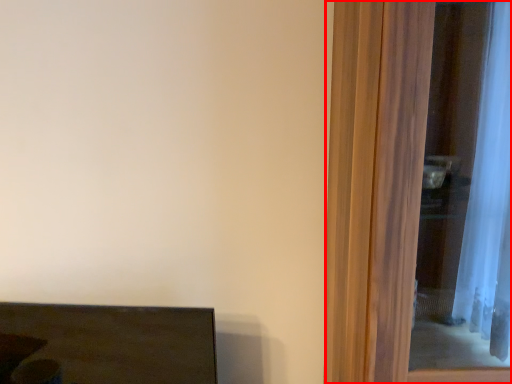
Question: From the image's perspective, what is the correct spatial relationship of screen door (annotated by the red box) in relation to furniture?

Choices:
 (A) above
 (B) below

Answer: (A)